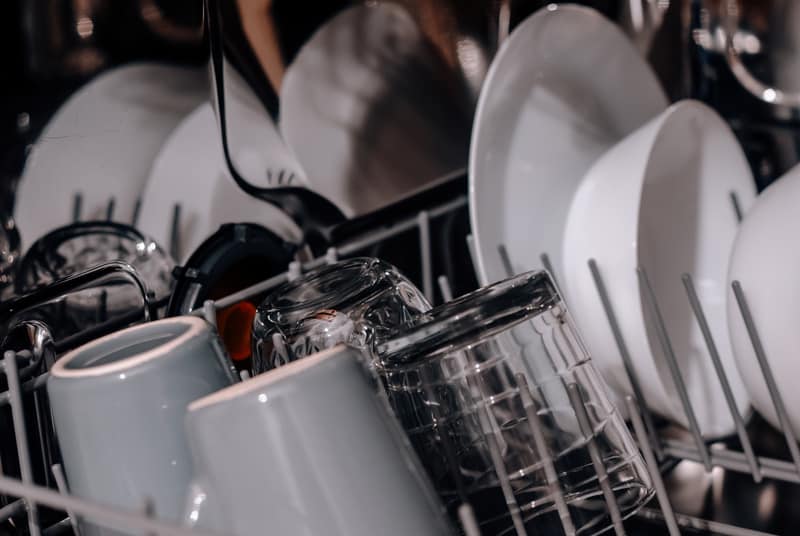
Identify the location of cups. The image size is (800, 536). (482, 364), (358, 316), (308, 420), (205, 375), (114, 249).